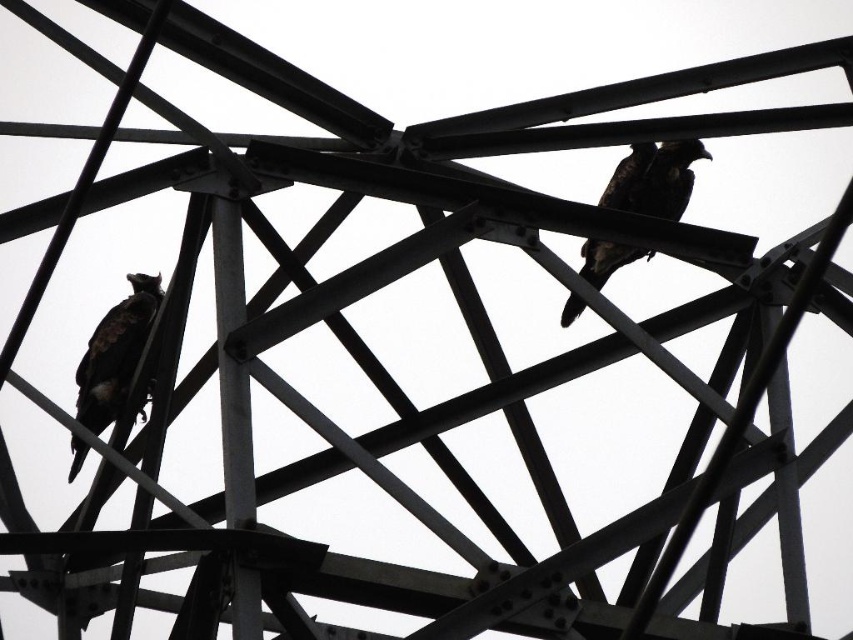
Question: Among these points, which one is farthest from the camera?

Choices:
 (A) (115, 314)
 (B) (689, 196)

Answer: (A)

Question: Can you confirm if dark brown feathers at left is wider than brown feathered bird at upper center?

Choices:
 (A) yes
 (B) no

Answer: (B)

Question: Which object is closer to the camera taking this photo?

Choices:
 (A) brown feathered bird at upper center
 (B) dark brown feathers at left

Answer: (A)

Question: Does dark brown feathers at left appear under brown feathered bird at upper center?

Choices:
 (A) no
 (B) yes

Answer: (B)

Question: Can you confirm if dark brown feathers at left is positioned below brown feathered bird at upper center?

Choices:
 (A) yes
 (B) no

Answer: (A)

Question: Which of the following is the closest to the observer?

Choices:
 (A) dark brown feathers at left
 (B) brown feathered bird at upper center

Answer: (B)